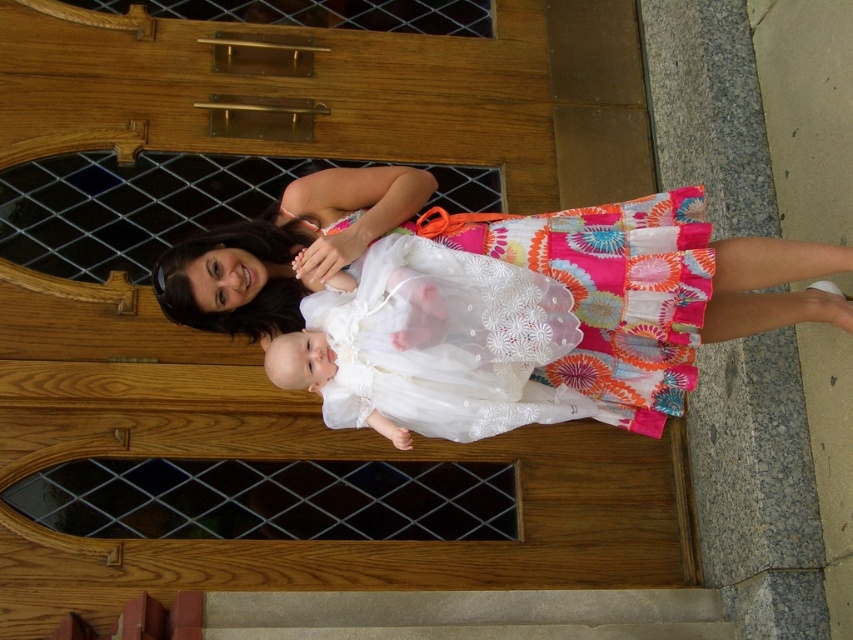
Question: Which object is closer to the camera taking this photo?

Choices:
 (A) white lace dress at center
 (B) smooth concrete stair at lower center

Answer: (B)

Question: Is white lace dress at center smaller than smooth concrete stair at lower center?

Choices:
 (A) yes
 (B) no

Answer: (A)

Question: Is white lace dress at center thinner than smooth concrete stair at lower center?

Choices:
 (A) no
 (B) yes

Answer: (B)

Question: Can you confirm if white lace dress at center is bigger than smooth concrete stair at lower center?

Choices:
 (A) no
 (B) yes

Answer: (A)

Question: Which point appears farthest from the camera in this image?

Choices:
 (A) (541, 369)
 (B) (181, 616)

Answer: (A)